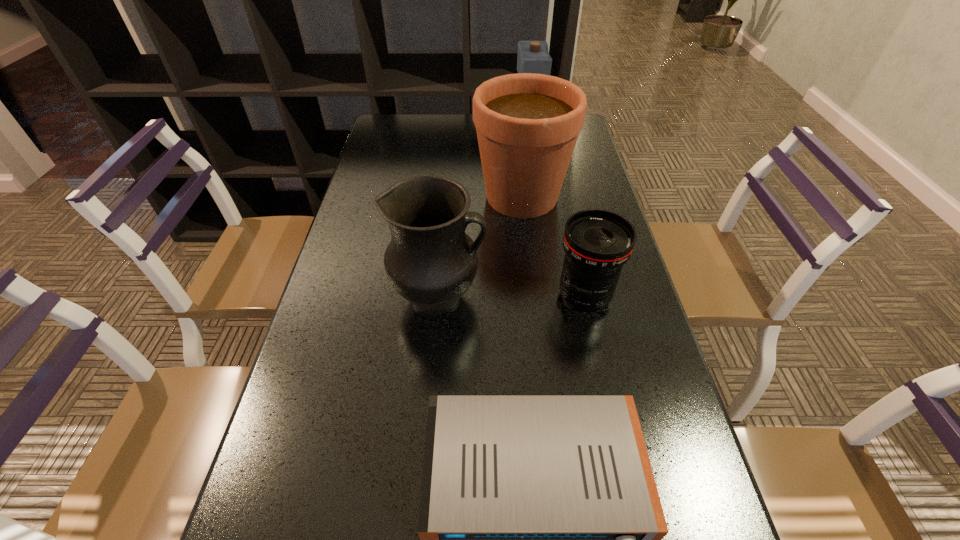
This screenshot has height=540, width=960. Find the location of `flowerpot`. flowerpot is located at coordinates (527, 124).

Where is `mallet`? The height and width of the screenshot is (540, 960). mallet is located at coordinates (533, 56).

Where is `pitcher`? pitcher is located at coordinates 431,262.

Locate an element on the screen. This screenshot has width=960, height=540. the fourth tallest object is located at coordinates (597, 243).

What are the coordinates of `free location located on the back of the second farthest object` in the screenshot? It's located at (516, 145).

The height and width of the screenshot is (540, 960). What are the coordinates of `blank area located 0.120m on the left of the mallet` in the screenshot? It's located at (481, 131).

Find the location of a particular element. This screenshot has width=960, height=540. blank area located 0.330m on the handle side of the pitcher is located at coordinates (626, 297).

Where is `free space located 0.110m on the left of the fourth tallest object`? The height and width of the screenshot is (540, 960). free space located 0.110m on the left of the fourth tallest object is located at coordinates (507, 296).

The width and height of the screenshot is (960, 540). Identify the location of object located in the far edge section of the desktop. (533, 56).

Locate an element on the screen. The height and width of the screenshot is (540, 960). flowerpot located in the right edge section of the desktop is located at coordinates (527, 124).